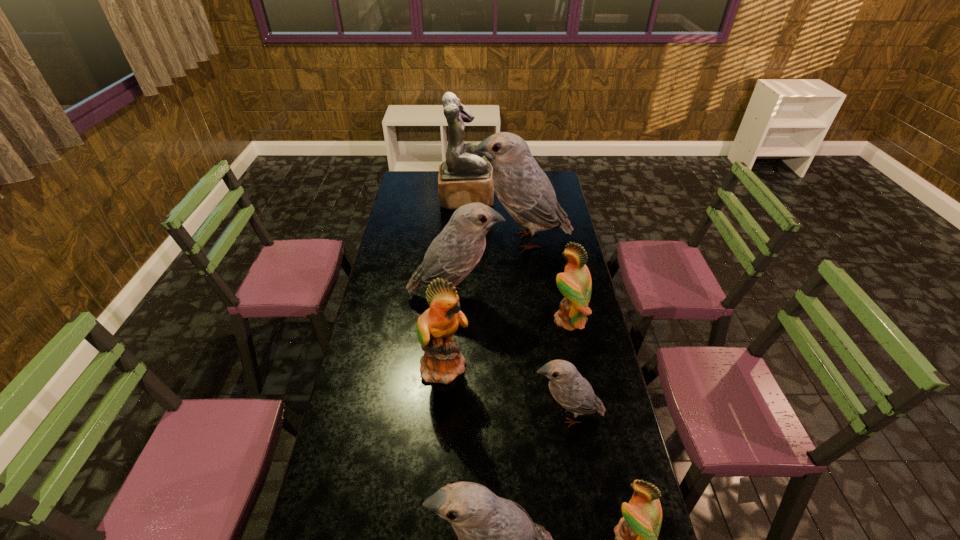
Where is `vacant space located on the front-facing side of the third farthest gray parrot`? The width and height of the screenshot is (960, 540). vacant space located on the front-facing side of the third farthest gray parrot is located at coordinates (425, 415).

Image resolution: width=960 pixels, height=540 pixels. What are the coordinates of `object present at the far edge` in the screenshot? It's located at (465, 177).

You are a GUI agent. You are given a task and a screenshot of the screen. Output one action in this format:
    pyautogui.click(x=<x>, y=<y>)
    Task: Click on the object situated at the left edge
    
    Given the screenshot: What is the action you would take?
    pyautogui.click(x=453, y=254)

Image resolution: width=960 pixels, height=540 pixels. I want to click on vacant area at the left edge, so click(x=369, y=387).

At what (x,y) coordinates should I click in order to perform the action: click on free space at the right edge of the desktop. Please return your answer as a coordinate pair (x, y). This screenshot has height=540, width=960. Looking at the image, I should click on (562, 198).

Locate an element on the screen. Image resolution: width=960 pixels, height=540 pixels. empty location between the sculpture and the sixth farthest object is located at coordinates (516, 307).

Where is `free spot between the sculpture and the fifth farthest parrot`? This screenshot has width=960, height=540. free spot between the sculpture and the fifth farthest parrot is located at coordinates (516, 307).

Identify the location of free space between the third nearest gray parrot and the farthest gray parrot. (489, 269).

At what (x,y) coordinates should I click in order to perform the action: click on free spot between the farthest green parrot and the sculpture. Please return your answer as a coordinate pair (x, y). This screenshot has width=960, height=540. Looking at the image, I should click on (517, 259).

Where is `vacant space in between the farthest green parrot and the sculpture`? The height and width of the screenshot is (540, 960). vacant space in between the farthest green parrot and the sculpture is located at coordinates click(517, 259).